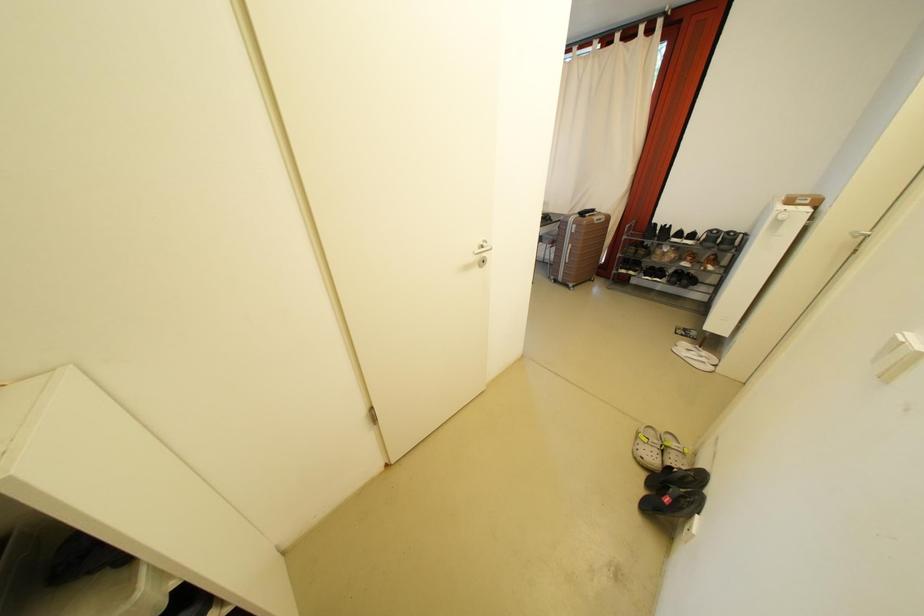
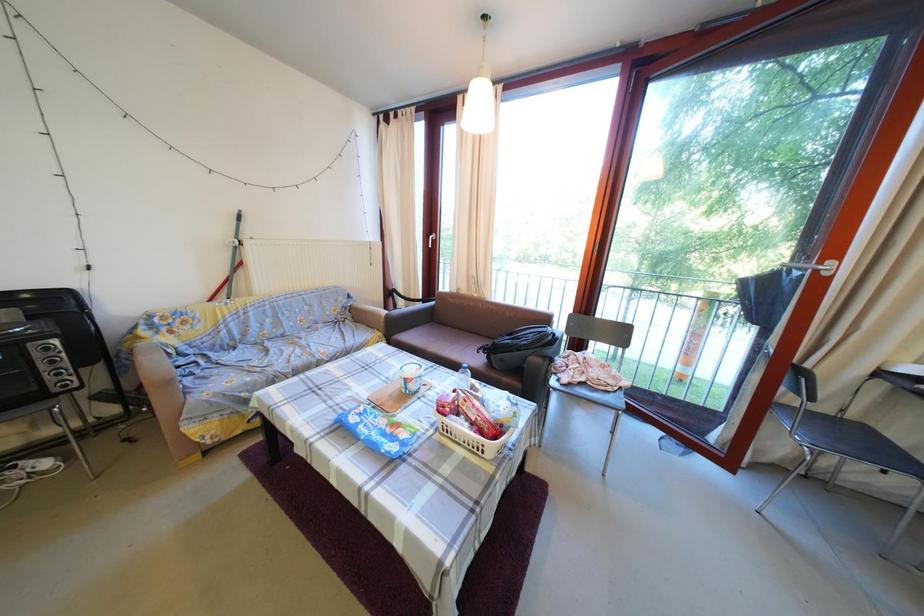
In a continuous first-person perspective shot, in which direction is the camera moving?

The movement direction of the cameraman is left, forward.